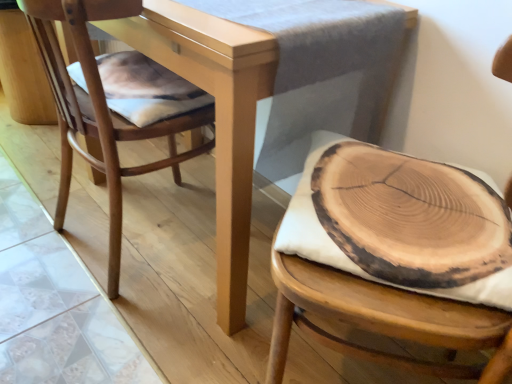
At what (x,y) coordinates should I click in order to perform the action: click on vacant point above natural wood slice at center (from a real-world perspective). Please return your answer as a coordinate pair (x, y). Looking at the image, I should click on (372, 175).